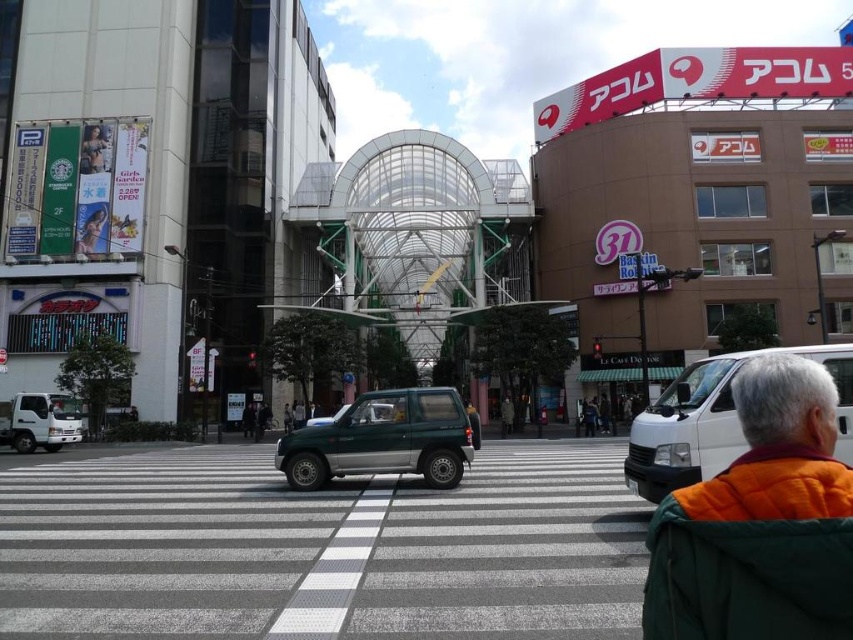
Question: Does metallic green car at center appear under orange quilted jacket at lower right?

Choices:
 (A) no
 (B) yes

Answer: (B)

Question: Which point appears farthest from the camera in this image?

Choices:
 (A) (693, 579)
 (B) (152, 564)
 (C) (366, 445)
 (D) (749, 349)

Answer: (D)

Question: Can you confirm if green matte car at center is thinner than orange quilted jacket at lower right?

Choices:
 (A) no
 (B) yes

Answer: (A)

Question: Which point is farther to the camera?

Choices:
 (A) metallic green car at center
 (B) orange quilted jacket at lower right
 (C) green matte suv at center
 (D) green matte car at center

Answer: (D)

Question: Is metallic green car at center to the right of orange quilted jacket at lower right from the viewer's perspective?

Choices:
 (A) no
 (B) yes

Answer: (A)

Question: Which point is farther from the camera taking this photo?

Choices:
 (A) (834, 410)
 (B) (610, 72)
 (C) (416, 445)
 (D) (706, 364)

Answer: (B)